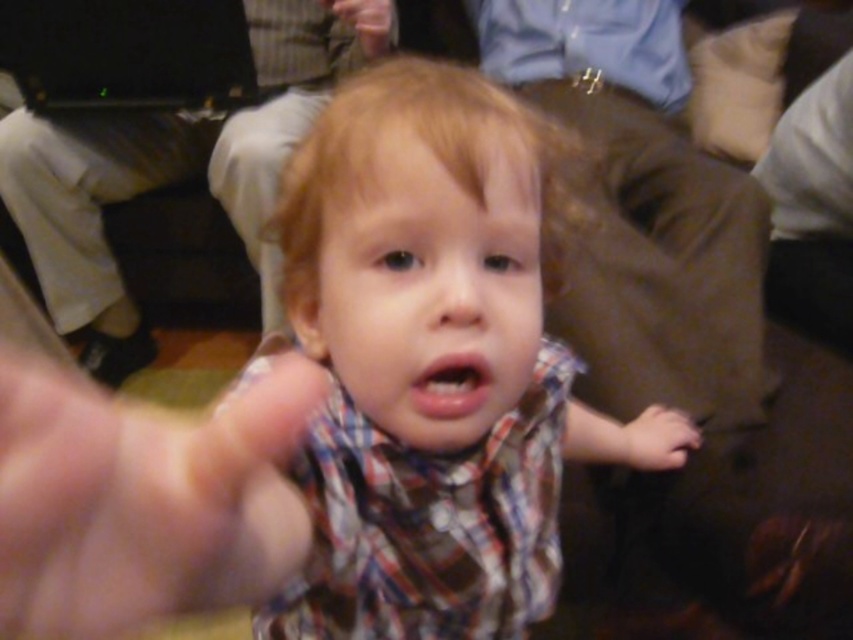
What is located at the point with coordinates (425, 372) in the image?

The point at (425, 372) is where the plaid fabric toddler at center is located.

You are at a social gathering and want to move from the point at coordinates point (589, 412) to the point at coordinates point (128, 552). Which direction should you move in to get closer to your destination?

To move from point (589, 412) to point (128, 552), you should move towards the upper right direction since point (128, 552) is located in the upper right relative to point (589, 412).